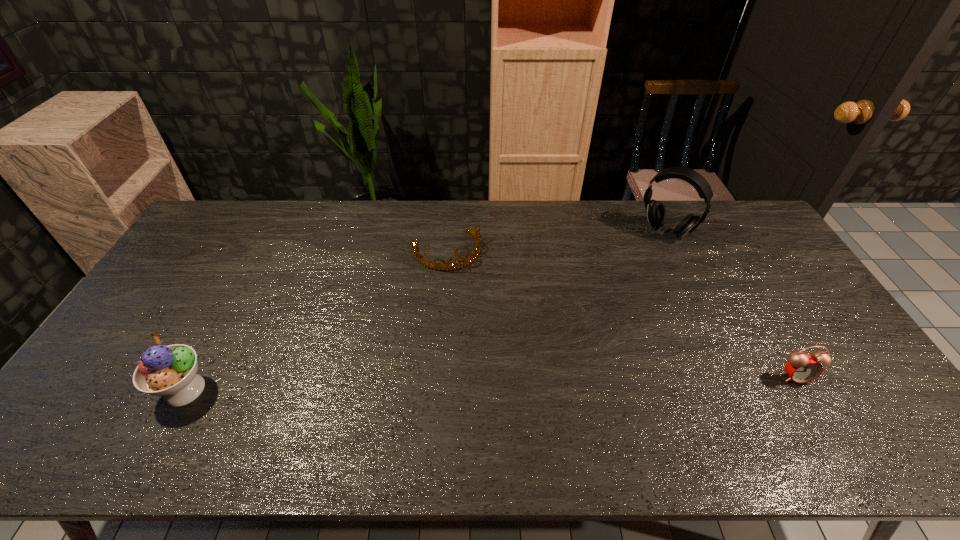
Identify the location of the leftmost object. The width and height of the screenshot is (960, 540). (170, 371).

Image resolution: width=960 pixels, height=540 pixels. Identify the location of the second tallest object. (170, 371).

Find the location of `alarm clock`. alarm clock is located at coordinates (802, 368).

What are the coordinates of `the rightmost object` in the screenshot? It's located at (802, 368).

Locate an element on the screen. The image size is (960, 540). the second object from left to right is located at coordinates (433, 265).

Where is `tiara`? The image size is (960, 540). tiara is located at coordinates (433, 265).

At what (x,y) coordinates should I click in order to perform the action: click on earphone. Please return your answer as a coordinate pair (x, y). The width and height of the screenshot is (960, 540). Looking at the image, I should click on (656, 212).

The image size is (960, 540). I want to click on the tallest object, so click(656, 212).

Where is `free spot located on the back of the icecream`? free spot located on the back of the icecream is located at coordinates (211, 340).

Where is `vacant region located on the clock face of the third tallest object`? The width and height of the screenshot is (960, 540). vacant region located on the clock face of the third tallest object is located at coordinates (812, 406).